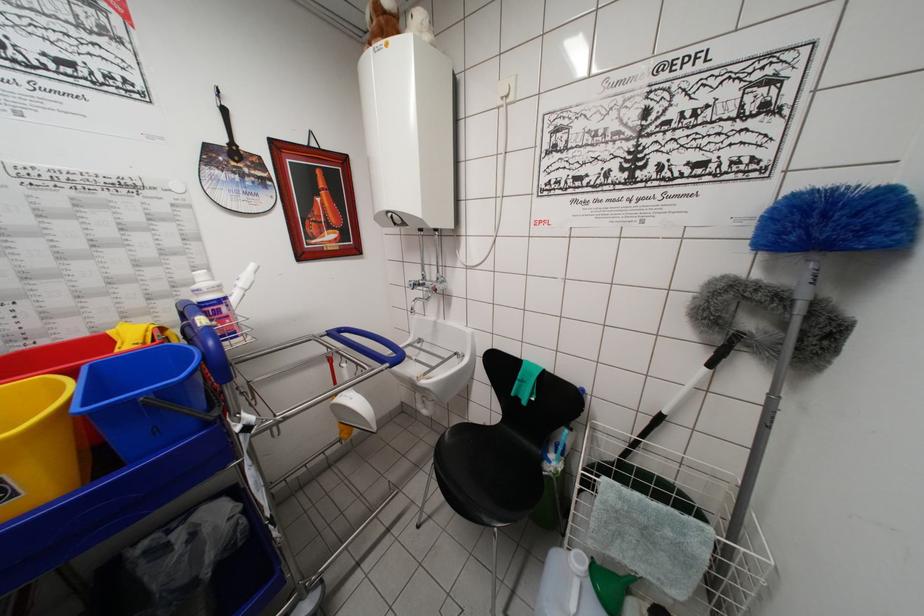
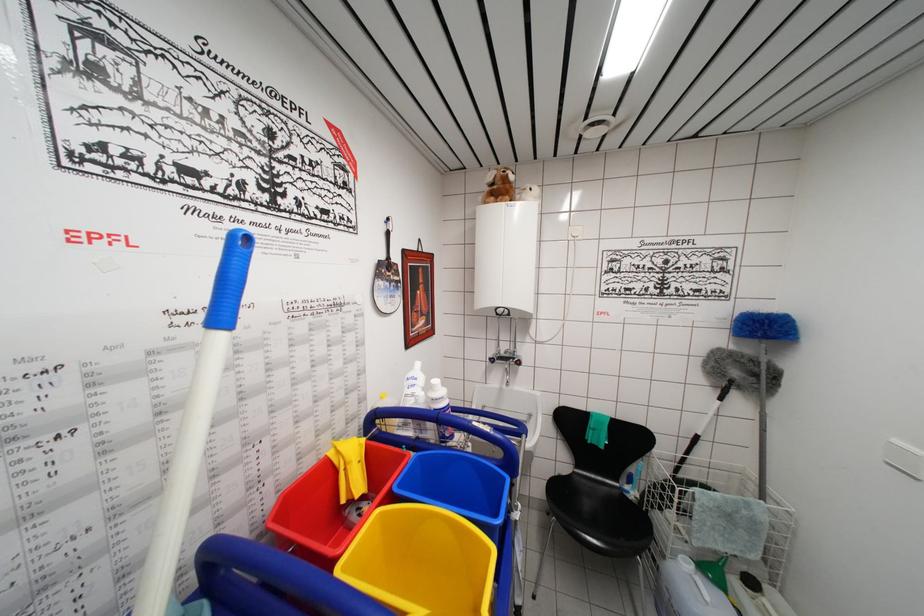
Question: The images are taken continuously from a first-person perspective. In which direction are you moving?

Choices:
 (A) Left
 (B) Right
 (C) Forward
 (D) Backward

Answer: (A)